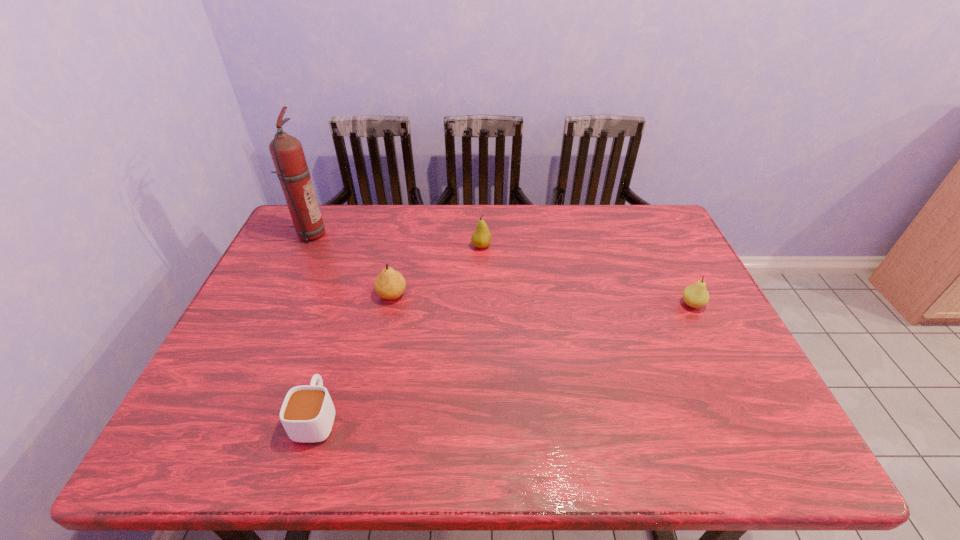
In order to click on the second closest pear to the cup in this screenshot , I will do `click(481, 238)`.

Where is `blank area in the image that satisfies the following two spatial constraints: 1. on the back side of the farthest pear; 2. on the side of the tallest object with the label and nozzle`? The width and height of the screenshot is (960, 540). blank area in the image that satisfies the following two spatial constraints: 1. on the back side of the farthest pear; 2. on the side of the tallest object with the label and nozzle is located at coordinates (481, 234).

This screenshot has height=540, width=960. I want to click on vacant area that satisfies the following two spatial constraints: 1. on the side of the rightmost object with the label and nozzle; 2. on the left side of the fire extinguisher, so click(x=276, y=305).

The width and height of the screenshot is (960, 540). In order to click on free spot that satisfies the following two spatial constraints: 1. on the side of the rightmost pear with the label and nozzle; 2. on the left side of the fire extinguisher in this screenshot , I will do (x=276, y=305).

At what (x,y) coordinates should I click in order to perform the action: click on free spot that satisfies the following two spatial constraints: 1. on the side of the tallest object with the label and nozzle; 2. on the side with the handle of the fourth object from right to left. Please return your answer as a coordinate pair (x, y). This screenshot has height=540, width=960. Looking at the image, I should click on (222, 416).

Image resolution: width=960 pixels, height=540 pixels. I want to click on free space that satisfies the following two spatial constraints: 1. on the side of the leftmost object with the label and nozzle; 2. on the right side of the second pear from left to right, so click(303, 246).

I want to click on free space that satisfies the following two spatial constraints: 1. on the side of the leftmost object with the label and nozzle; 2. on the right side of the leftmost pear, so click(x=280, y=295).

Image resolution: width=960 pixels, height=540 pixels. What are the coordinates of `free point that satisfies the following two spatial constraints: 1. on the side with the handle of the leftmost pear; 2. on the right side of the fourth object from right to left` in the screenshot? It's located at (354, 295).